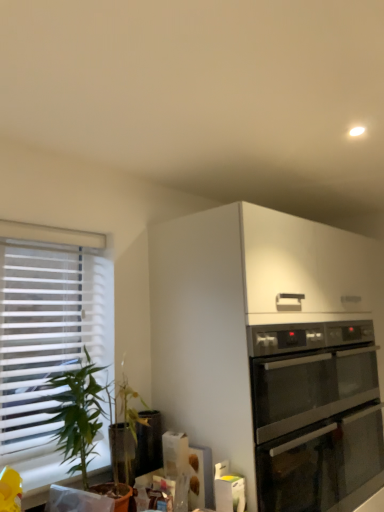
Question: Considering the relative sizes of stainless steel oven at lower right and satin silver oven at upper right in the image provided, is stainless steel oven at lower right wider than satin silver oven at upper right?

Choices:
 (A) no
 (B) yes

Answer: (B)

Question: Is the position of stainless steel oven at lower right less distant than that of satin silver oven at upper right?

Choices:
 (A) no
 (B) yes

Answer: (B)

Question: Is stainless steel oven at lower right further to camera compared to satin silver oven at upper right?

Choices:
 (A) no
 (B) yes

Answer: (A)

Question: Considering the relative sizes of stainless steel oven at lower right and satin silver oven at upper right in the image provided, is stainless steel oven at lower right smaller than satin silver oven at upper right?

Choices:
 (A) no
 (B) yes

Answer: (A)

Question: Is stainless steel oven at lower right taller than satin silver oven at upper right?

Choices:
 (A) yes
 (B) no

Answer: (B)

Question: From the image's perspective, is stainless steel oven at lower right above satin silver oven at upper right?

Choices:
 (A) yes
 (B) no

Answer: (A)

Question: Are stainless steel oven at lower right and white blinds at left beside each other?

Choices:
 (A) yes
 (B) no

Answer: (B)

Question: Is stainless steel oven at lower right looking in the opposite direction of white blinds at left?

Choices:
 (A) no
 (B) yes

Answer: (A)

Question: Is stainless steel oven at lower right bigger than white blinds at left?

Choices:
 (A) yes
 (B) no

Answer: (A)

Question: From a real-world perspective, is stainless steel oven at lower right on top of white blinds at left?

Choices:
 (A) yes
 (B) no

Answer: (B)

Question: Is stainless steel oven at lower right far away from white blinds at left?

Choices:
 (A) yes
 (B) no

Answer: (B)

Question: From the image's perspective, is stainless steel oven at lower right on white blinds at left?

Choices:
 (A) no
 (B) yes

Answer: (A)

Question: From the image's perspective, is green leafy plant at left located beneath satin silver oven at upper right?

Choices:
 (A) yes
 (B) no

Answer: (B)